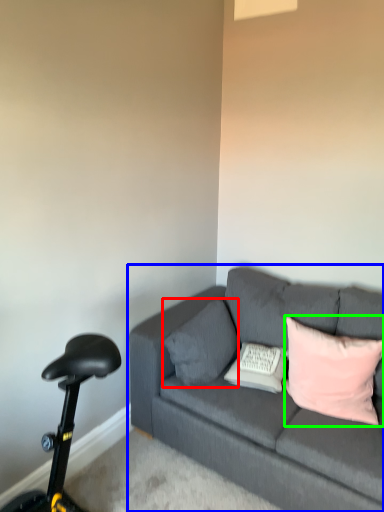
Question: Which is nearer to the pillow (highlighted by a red box)? studio couch (highlighted by a blue box) or pillow (highlighted by a green box).

Choices:
 (A) studio couch
 (B) pillow

Answer: (A)